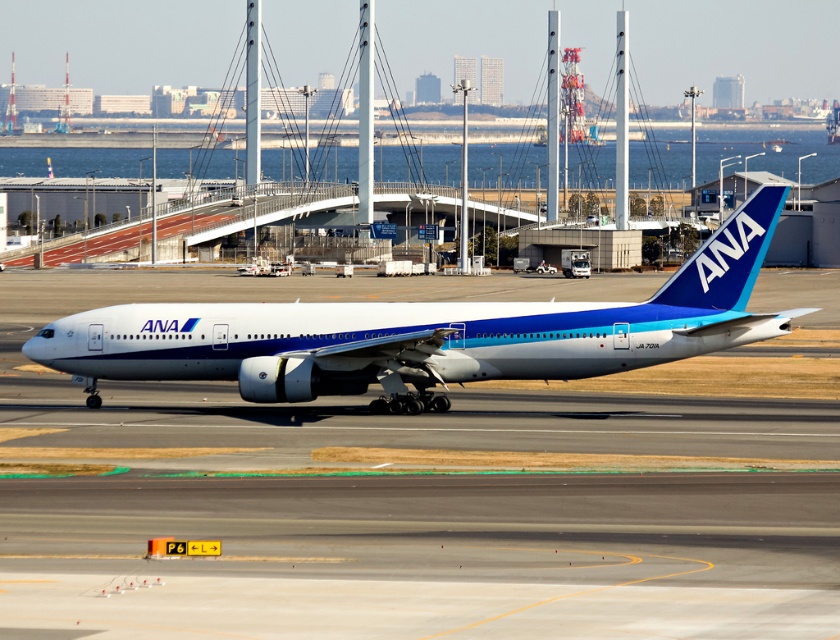
You are a ground crew member directing an airplane to taxiway P6. You see two points on the tarmac labeled as point (353, 529) and point (453, 365). Which point should you direct the plane to first to reach taxiway P6 efficiently?

Point (353, 529) should be directed first because it is in front of point (453, 365), meaning it is closer to the desired direction of taxiway P6.

You are a ground crew member inspecting the tarmac for debris. You notice the white smooth tarmac at center and the white glossy airplane at center. Which object is positioned to the right of the other?

The white smooth tarmac at center is to the right of the white glossy airplane at center.